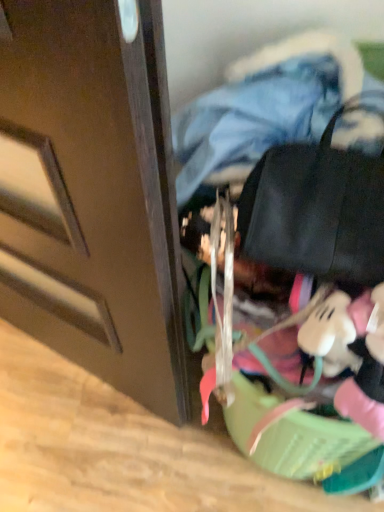
Question: From a real-world perspective, is denim jacket at upper center located higher than black leather messenger bag at upper right?

Choices:
 (A) yes
 (B) no

Answer: (A)

Question: Is denim jacket at upper center behind black leather messenger bag at upper right?

Choices:
 (A) yes
 (B) no

Answer: (A)

Question: From the image's perspective, is denim jacket at upper center above black leather messenger bag at upper right?

Choices:
 (A) no
 (B) yes

Answer: (B)

Question: Does denim jacket at upper center appear on the left side of black leather messenger bag at upper right?

Choices:
 (A) no
 (B) yes

Answer: (B)

Question: Considering the relative sizes of denim jacket at upper center and black leather messenger bag at upper right in the image provided, is denim jacket at upper center taller than black leather messenger bag at upper right?

Choices:
 (A) yes
 (B) no

Answer: (A)

Question: Can you confirm if denim jacket at upper center is thinner than black leather messenger bag at upper right?

Choices:
 (A) no
 (B) yes

Answer: (A)

Question: From the image's perspective, is black leather messenger bag at upper right beneath denim jacket at upper center?

Choices:
 (A) yes
 (B) no

Answer: (A)

Question: Is black leather messenger bag at upper right far from denim jacket at upper center?

Choices:
 (A) yes
 (B) no

Answer: (B)

Question: Could you tell me if black leather messenger bag at upper right is facing denim jacket at upper center?

Choices:
 (A) yes
 (B) no

Answer: (B)

Question: Is black leather messenger bag at upper right to the left of denim jacket at upper center from the viewer's perspective?

Choices:
 (A) yes
 (B) no

Answer: (B)

Question: Does black leather messenger bag at upper right have a greater height compared to denim jacket at upper center?

Choices:
 (A) yes
 (B) no

Answer: (B)

Question: Is the depth of black leather messenger bag at upper right less than that of denim jacket at upper center?

Choices:
 (A) no
 (B) yes

Answer: (B)

Question: Looking at the image, does black leather messenger bag at upper right seem bigger or smaller compared to denim jacket at upper center?

Choices:
 (A) small
 (B) big

Answer: (A)